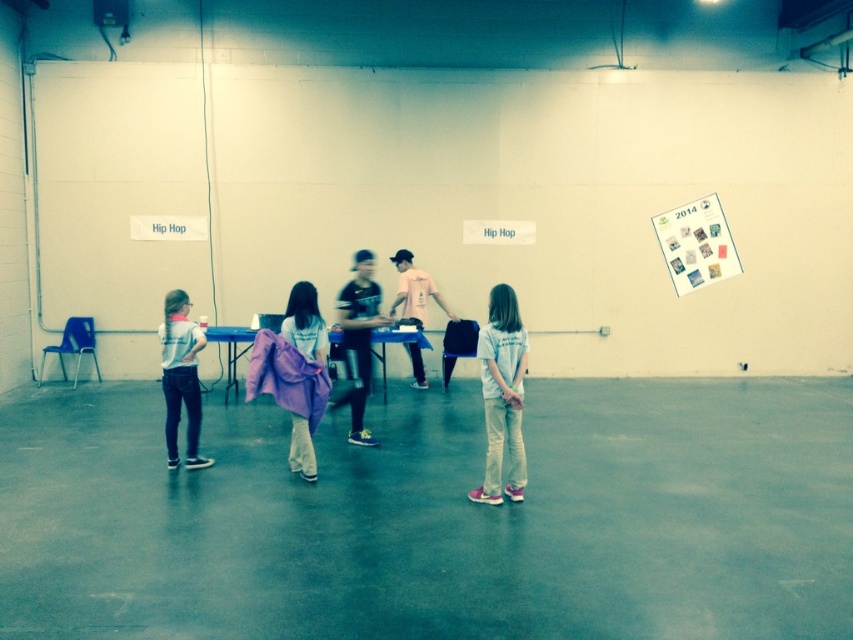
Is light gray fabric shirt at left taller than black matte shirt at center?

Incorrect, light gray fabric shirt at left's height is not larger of black matte shirt at center's.

Consider the image. Can you confirm if light gray fabric shirt at left is positioned above black matte shirt at center?

Actually, light gray fabric shirt at left is below black matte shirt at center.

Is point (194, 342) positioned after point (354, 362)?

No, (194, 342) is closer to viewer.

Where is `light gray fabric shirt at left`? The width and height of the screenshot is (853, 640). light gray fabric shirt at left is located at coordinates (181, 378).

Is point (364, 257) farther from camera compared to point (426, 387)?

No, (364, 257) is closer to viewer.

Is point (360, 426) closer to viewer compared to point (399, 262)?

Yes, it is.

Does point (338, 296) come closer to viewer compared to point (413, 296)?

No.

The image size is (853, 640). What are the coordinates of `black matte shirt at center` in the screenshot? It's located at (358, 339).

Can you confirm if light gray fabric shirt at left is positioned to the right of purple fabric at center?

In fact, light gray fabric shirt at left is to the left of purple fabric at center.

Where is `light gray fabric shirt at left`? This screenshot has height=640, width=853. light gray fabric shirt at left is located at coordinates point(181,378).

Does point (167, 328) come behind point (320, 401)?

Yes.

Where is `light gray fabric shirt at left`? The height and width of the screenshot is (640, 853). light gray fabric shirt at left is located at coordinates (181, 378).